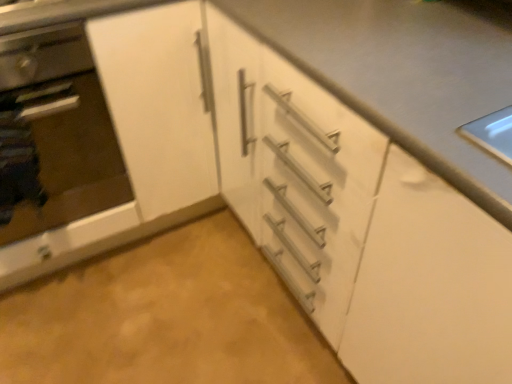
Question: Is white matte countertop at center turned away from satin silver oven at left?

Choices:
 (A) yes
 (B) no

Answer: (B)

Question: From the image's perspective, does white matte countertop at center appear higher than satin silver oven at left?

Choices:
 (A) no
 (B) yes

Answer: (A)

Question: Considering the relative sizes of white matte countertop at center and satin silver oven at left in the image provided, is white matte countertop at center smaller than satin silver oven at left?

Choices:
 (A) yes
 (B) no

Answer: (B)

Question: Considering the relative positions of white matte countertop at center and satin silver oven at left in the image provided, is white matte countertop at center to the left of satin silver oven at left from the viewer's perspective?

Choices:
 (A) no
 (B) yes

Answer: (A)

Question: From a real-world perspective, is white matte countertop at center on top of satin silver oven at left?

Choices:
 (A) yes
 (B) no

Answer: (B)

Question: Relative to white matte countertop at center, is satin silver oven at left in front or behind?

Choices:
 (A) front
 (B) behind

Answer: (B)

Question: From a real-world perspective, is satin silver oven at left above or below white matte countertop at center?

Choices:
 (A) above
 (B) below

Answer: (A)

Question: Is point (84, 76) positioned closer to the camera than point (289, 8)?

Choices:
 (A) farther
 (B) closer

Answer: (A)

Question: Would you say satin silver oven at left is inside or outside white matte countertop at center?

Choices:
 (A) inside
 (B) outside

Answer: (B)

Question: Is point (72, 192) closer or farther from the camera than point (93, 64)?

Choices:
 (A) farther
 (B) closer

Answer: (A)

Question: Is white matte cabinet at center wider or thinner than satin silver oven at left?

Choices:
 (A) wide
 (B) thin

Answer: (A)

Question: Considering the positions of white matte cabinet at center and satin silver oven at left in the image, is white matte cabinet at center bigger or smaller than satin silver oven at left?

Choices:
 (A) big
 (B) small

Answer: (A)

Question: Is white matte cabinet at center in front of or behind satin silver oven at left in the image?

Choices:
 (A) behind
 (B) front

Answer: (A)

Question: Is white matte countertop at center in front of or behind white matte cabinet at center in the image?

Choices:
 (A) front
 (B) behind

Answer: (A)

Question: Is point (415, 155) closer or farther from the camera than point (72, 235)?

Choices:
 (A) farther
 (B) closer

Answer: (B)